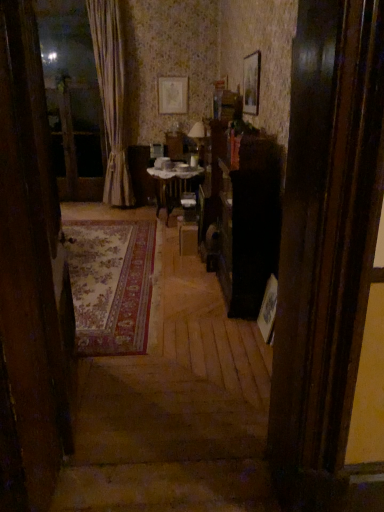
Image resolution: width=384 pixels, height=512 pixels. Find the location of `wooden table at center`. wooden table at center is located at coordinates click(x=173, y=183).

At what (x,y) coordinates should I click in order to perform the action: click on wooden picture frame at upper center, which is counted as the second picture frame, starting from the back. Please return your answer as a coordinate pair (x, y). The width and height of the screenshot is (384, 512). Looking at the image, I should click on (251, 83).

At what (x,y) coordinates should I click in order to perform the action: click on silky beige curtain at left. Please return your answer as a coordinate pair (x, y). This screenshot has width=384, height=512. Looking at the image, I should click on (111, 97).

Measure the distance between point (48,270) and camera.

Point (48,270) is 5.65 feet from camera.

Describe the element at coordinates (172, 95) in the screenshot. I see `matte paper picture frame at upper center, the 2th picture frame from the front` at that location.

Where is `wooden table at center`? The width and height of the screenshot is (384, 512). wooden table at center is located at coordinates (173, 183).

Is wooden picture frame at upper center, the first picture frame in the front-to-back sequence, far from silky beige curtain at left?

Yes, wooden picture frame at upper center, the first picture frame in the front-to-back sequence, and silky beige curtain at left are located far from each other.

Is point (257, 60) farther from viewer compared to point (123, 199)?

That is False.

Which object is wider, wooden picture frame at upper center, the 1th picture frame from the right, or silky beige curtain at left?

Wider between the two is silky beige curtain at left.

How different are the orientations of wooden picture frame at upper center, the first picture frame in the front-to-back sequence, and silky beige curtain at left in degrees?

85.1 degrees separate the facing orientations of wooden picture frame at upper center, the first picture frame in the front-to-back sequence, and silky beige curtain at left.

Would you say wooden table at center is outside matte paper picture frame at upper center, which is the 1th picture frame in back-to-front order?

wooden table at center lies outside matte paper picture frame at upper center, which is the 1th picture frame in back-to-front order,'s area.

Which is farther from the camera, (175, 203) or (164, 80)?

Point (175, 203)

What's the angular difference between wooden table at center and matte paper picture frame at upper center, which is the 1th picture frame in back-to-front order,'s facing directions?

The facing directions of wooden table at center and matte paper picture frame at upper center, which is the 1th picture frame in back-to-front order, are 90.5 degrees apart.

Based on the photo, is the depth of wooden table at center greater than that of matte paper picture frame at upper center, which is the 1th picture frame from top to bottom?

That is False.

In terms of width, does wooden table at center look wider or thinner when compared to wooden picture frame at upper center, the second picture frame from the top?

Considering their sizes, wooden table at center looks broader than wooden picture frame at upper center, the second picture frame from the top.

Which is more distant, (169, 176) or (246, 73)?

The point (169, 176) is farther from the camera.

From the image's perspective, is wooden table at center beneath wooden picture frame at upper center, which is the second picture frame from left to right?

Yes.

Can you tell me how much wooden table at center and wooden picture frame at upper center, which is counted as the second picture frame, starting from the back, differ in facing direction?

There is a 0.401-degree angle between the facing directions of wooden table at center and wooden picture frame at upper center, which is counted as the second picture frame, starting from the back.

From the image's perspective, is silky beige curtain at left beneath wooden table at center?

No.

Is point (130, 181) in front of point (152, 167)?

That is False.

Considering the relative sizes of silky beige curtain at left and wooden table at center in the image provided, is silky beige curtain at left wider than wooden table at center?

No.

Does wooden table at center have a lesser width compared to carpeted rug at left?

No.

Who is shorter, wooden table at center or carpeted rug at left?

wooden table at center is shorter.

From a real-world perspective, which is physically above, wooden table at center or carpeted rug at left?

From a 3D spatial view, carpeted rug at left is above.

Between matte paper picture frame at upper center, which is the second picture frame in right-to-left order, and wooden picture frame at upper center, which is the second picture frame from left to right, which one is positioned in front?

wooden picture frame at upper center, which is the second picture frame from left to right, is more forward.

At what (x,y) coordinates should I click in order to perform the action: click on picture frame above the wooden picture frame at upper center, the second picture frame from the top (from the image's perspective). Please return your answer as a coordinate pair (x, y). The height and width of the screenshot is (512, 384). Looking at the image, I should click on (172, 95).

Can you tell me how much matte paper picture frame at upper center, which is the 1th picture frame from top to bottom, and wooden picture frame at upper center, which ranks as the 1th picture frame in bottom-to-top order, differ in facing direction?

The angle between the facing direction of matte paper picture frame at upper center, which is the 1th picture frame from top to bottom, and the facing direction of wooden picture frame at upper center, which ranks as the 1th picture frame in bottom-to-top order, is 90.1 degrees.

From a real-world perspective, is matte paper picture frame at upper center, which is the second picture frame in right-to-left order, on wooden picture frame at upper center, the first picture frame in the front-to-back sequence?

No, from a real-world perspective, matte paper picture frame at upper center, which is the second picture frame in right-to-left order, is not over wooden picture frame at upper center, the first picture frame in the front-to-back sequence

Is point (119, 7) positioned before point (17, 407)?

No, (119, 7) is further to viewer.

Considering the sizes of objects silky beige curtain at left and carpeted rug at left in the image provided, who is smaller, silky beige curtain at left or carpeted rug at left?

carpeted rug at left is smaller.

From a real-world perspective, does silky beige curtain at left stand above carpeted rug at left?

Yes, from a real-world perspective, silky beige curtain at left is above carpeted rug at left.

Which of these two, silky beige curtain at left or carpeted rug at left, is wider?

silky beige curtain at left is wider.

In order to click on curtain on the left of wooden picture frame at upper center, which is counted as the second picture frame, starting from the back in this screenshot , I will do `click(111, 97)`.

Identify the location of table located below the matte paper picture frame at upper center, which is the 1th picture frame in back-to-front order (from the image's perspective). (173, 183).

Considering their positions, is wooden picture frame at upper center, which ranks as the 1th picture frame in bottom-to-top order, positioned closer to silky beige curtain at left than matte paper picture frame at upper center, which is the second picture frame in right-to-left order?

Among the two, matte paper picture frame at upper center, which is the second picture frame in right-to-left order, is located nearer to silky beige curtain at left.

Looking at the image, which one is located closer to wooden picture frame at upper center, which is the second picture frame from left to right, silky beige curtain at left or matte paper picture frame at upper center, arranged as the second picture frame when ordered from the bottom?

Among the two, matte paper picture frame at upper center, arranged as the second picture frame when ordered from the bottom, is located nearer to wooden picture frame at upper center, which is the second picture frame from left to right.

Based on the photo, when comparing their distances from matte paper picture frame at upper center, acting as the first picture frame starting from the left, does wooden table at center or silky beige curtain at left seem further?

wooden table at center is further to matte paper picture frame at upper center, acting as the first picture frame starting from the left.

Based on their spatial positions, is silky beige curtain at left or wooden table at center further from wooden picture frame at upper center, the second picture frame from the top?

silky beige curtain at left.

Estimate the real-world distances between objects in this image. Which object is closer to wooden table at center, silky beige curtain at left or matte paper picture frame at upper center, which is the 1th picture frame in back-to-front order?

matte paper picture frame at upper center, which is the 1th picture frame in back-to-front order, is positioned closer to the anchor wooden table at center.

Looking at the image, which one is located further to matte paper picture frame at upper center, arranged as the second picture frame when ordered from the bottom, silky beige curtain at left or carpeted rug at left?

Based on the image, carpeted rug at left appears to be further to matte paper picture frame at upper center, arranged as the second picture frame when ordered from the bottom.

When comparing their distances from carpeted rug at left, does matte paper picture frame at upper center, the 2th picture frame from the front, or wooden picture frame at upper center, which ranks as the 1th picture frame in bottom-to-top order, seem further?

Based on the image, matte paper picture frame at upper center, the 2th picture frame from the front, appears to be further to carpeted rug at left.

Looking at the image, which one is located further to matte paper picture frame at upper center, which is the 1th picture frame in back-to-front order, wooden picture frame at upper center, which is counted as the second picture frame, starting from the back, or carpeted rug at left?

Based on the image, carpeted rug at left appears to be further to matte paper picture frame at upper center, which is the 1th picture frame in back-to-front order.

This screenshot has width=384, height=512. What are the coordinates of `curtain between matte paper picture frame at upper center, the 2th picture frame from the front, and wooden table at center from top to bottom` in the screenshot? It's located at (111, 97).

I want to click on curtain positioned between carpeted rug at left and matte paper picture frame at upper center, which is the 1th picture frame from top to bottom, from near to far, so click(x=111, y=97).

At what (x,y) coordinates should I click in order to perform the action: click on picture frame between carpeted rug at left and matte paper picture frame at upper center, acting as the first picture frame starting from the left, along the z-axis. Please return your answer as a coordinate pair (x, y). Image resolution: width=384 pixels, height=512 pixels. Looking at the image, I should click on (251, 83).

Find the location of a particular element. This screenshot has width=384, height=512. picture frame located between carpeted rug at left and wooden table at center in the depth direction is located at coordinates (251, 83).